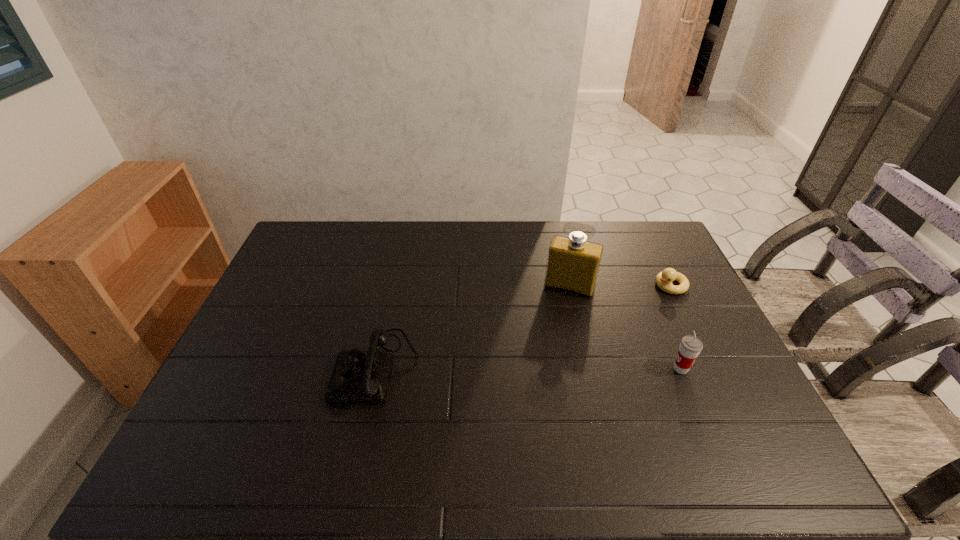
You are a GUI agent. You are given a task and a screenshot of the screen. Output one action in this format:
    pyautogui.click(x=<x>, y=<y>)
    Task: Click on the free space on the desktop that is between the third tallest object and the cup and is positioned on the front-facing side of the perfume
    The image size is (960, 540).
    Given the screenshot: What is the action you would take?
    pyautogui.click(x=544, y=368)

This screenshot has height=540, width=960. In order to click on vacant space on the desktop that is between the leftmost object and the cup and is positioned at the beak of the duckling in this screenshot , I will do `click(509, 368)`.